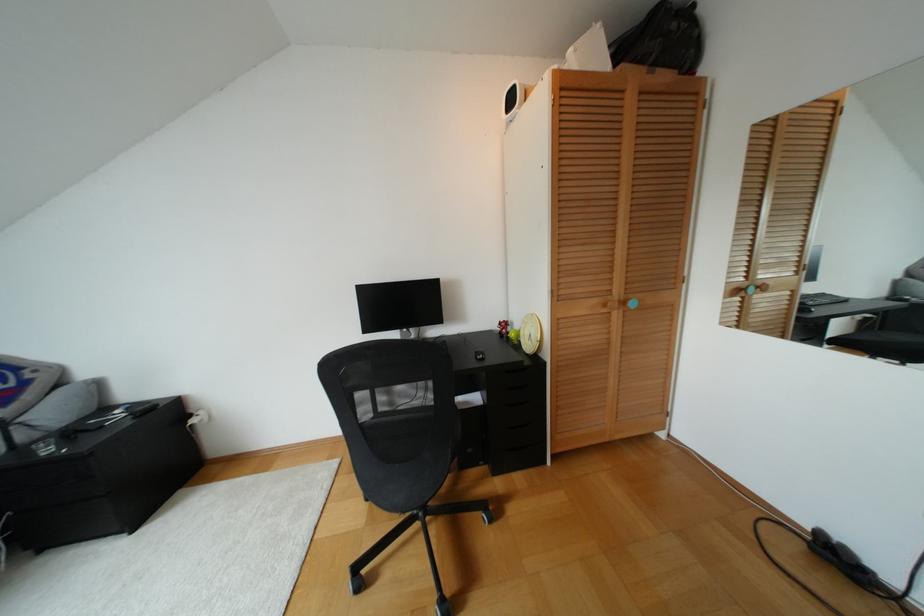
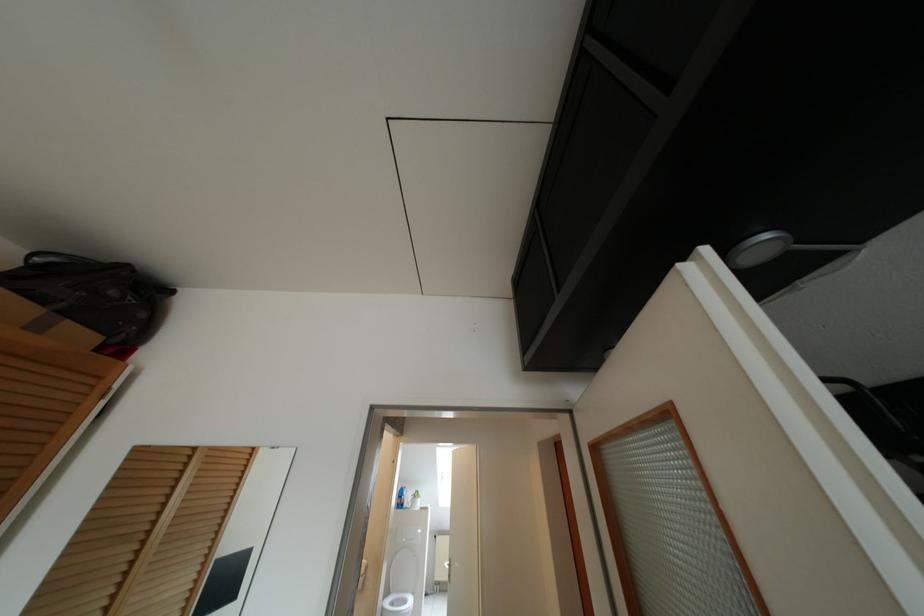
The images are taken continuously from a first-person perspective. In which direction is your viewpoint rotating?

The camera's rotation is toward right-up.